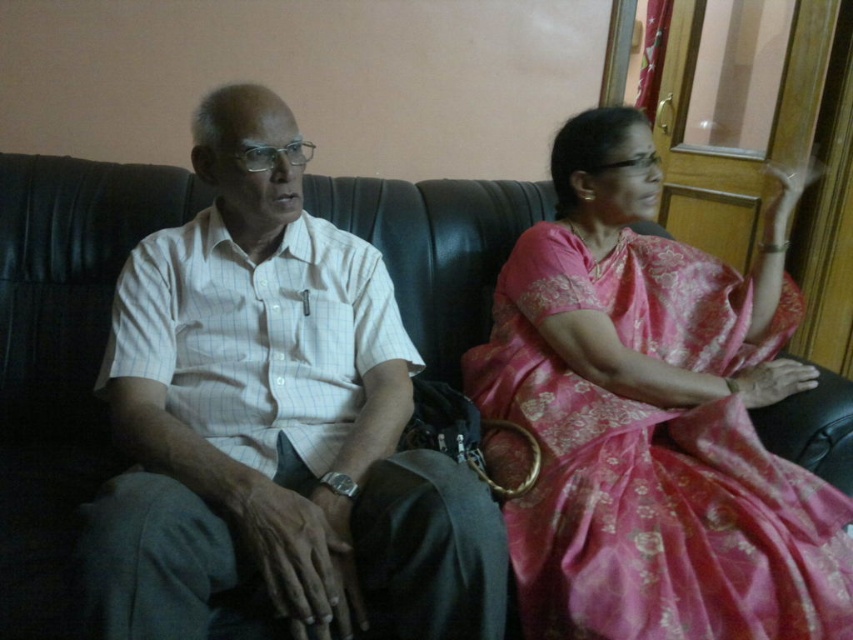
Question: Which object is closer to the camera taking this photo?

Choices:
 (A) white striped shirt at center
 (B) pink silk saree at right

Answer: (A)

Question: Is white striped shirt at center bigger than pink silk saree at right?

Choices:
 (A) no
 (B) yes

Answer: (A)

Question: From the image, what is the correct spatial relationship of white striped shirt at center in relation to pink silk saree at right?

Choices:
 (A) above
 (B) below

Answer: (A)

Question: Does white striped shirt at center have a larger size compared to pink silk saree at right?

Choices:
 (A) no
 (B) yes

Answer: (A)

Question: Which point is farther from the camera taking this photo?

Choices:
 (A) (379, 512)
 (B) (637, 337)

Answer: (B)